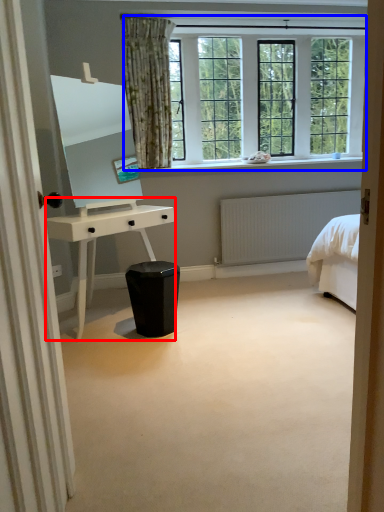
Question: Among these objects, which one is farthest to the camera, desk (highlighted by a red box) or window (highlighted by a blue box)?

Choices:
 (A) desk
 (B) window

Answer: (B)